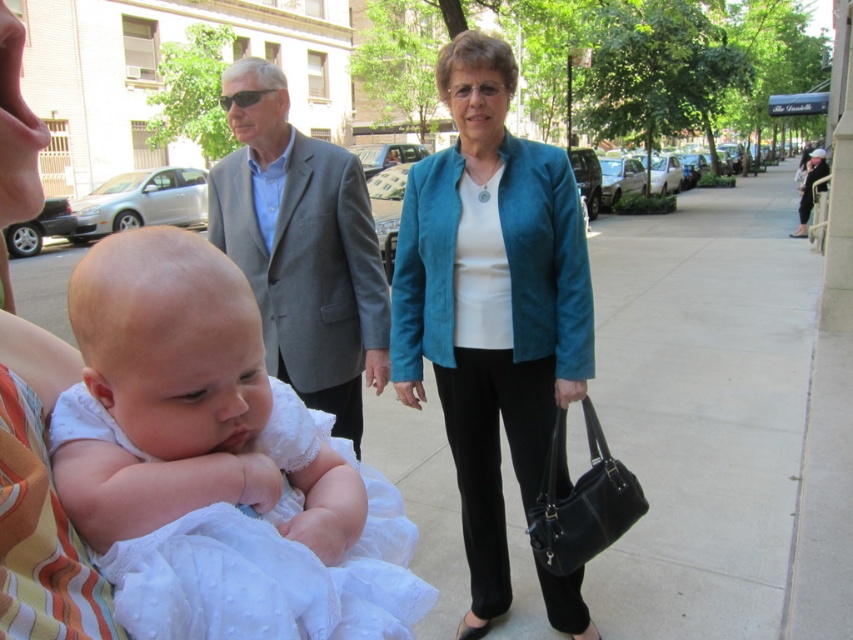
Looking at this image, does smooth concrete sidewalk at center have a smaller size compared to teal leather jacket at center?

No.

Who is positioned more to the right, smooth concrete sidewalk at center or teal leather jacket at center?

Positioned to the right is smooth concrete sidewalk at center.

Where is `smooth concrete sidewalk at center`? This screenshot has height=640, width=853. smooth concrete sidewalk at center is located at coordinates (703, 406).

In order to click on smooth concrete sidewalk at center in this screenshot , I will do `click(703, 406)`.

Is point (405, 330) in front of point (329, 192)?

Yes.

Which of these two, teal suede blazer at center or gray fabric suit at center, stands shorter?

gray fabric suit at center is shorter.

Who is more distant from viewer, (445, 317) or (233, 128)?

The point (233, 128) is more distant.

You are a GUI agent. You are given a task and a screenshot of the screen. Output one action in this format:
    pyautogui.click(x=<x>, y=<y>)
    Task: Click on the teal suede blazer at center
    The width and height of the screenshot is (853, 640).
    Given the screenshot: What is the action you would take?
    pyautogui.click(x=490, y=301)

Is smooth concrete sidewalk at center wider than gray fabric suit at center?

Yes, smooth concrete sidewalk at center is wider than gray fabric suit at center.

Which is below, smooth concrete sidewalk at center or gray fabric suit at center?

gray fabric suit at center is below.

Does point (636, 365) lie behind point (259, 106)?

Yes.

Where is `smooth concrete sidewalk at center`? The height and width of the screenshot is (640, 853). smooth concrete sidewalk at center is located at coordinates (703, 406).